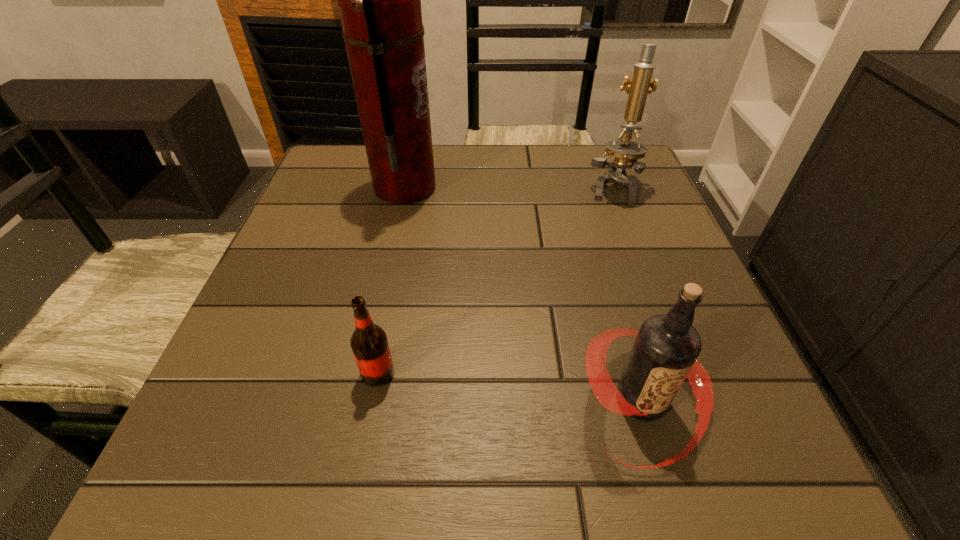
Where is `the tallest object`? Image resolution: width=960 pixels, height=540 pixels. the tallest object is located at coordinates point(379,0).

Image resolution: width=960 pixels, height=540 pixels. I want to click on microscope, so click(x=626, y=152).

This screenshot has height=540, width=960. I want to click on the taller root beer, so click(x=666, y=348).

This screenshot has width=960, height=540. Identify the location of the second shortest object. (666, 348).

Identify the location of the shorter root beer. The image size is (960, 540). (369, 343).

Find the location of a particular element. This screenshot has width=960, height=540. the shortest object is located at coordinates (369, 343).

Where is `vacant region located on the nozzle side of the fire extinguisher`? Image resolution: width=960 pixels, height=540 pixels. vacant region located on the nozzle side of the fire extinguisher is located at coordinates (518, 188).

Where is `free space located 0.280m on the front of the microscope`? The image size is (960, 540). free space located 0.280m on the front of the microscope is located at coordinates (654, 300).

Identify the location of vacant space located on the left of the shorter root beer. (243, 373).

Identify the location of fire extinguisher that is at the far edge. (379, 0).